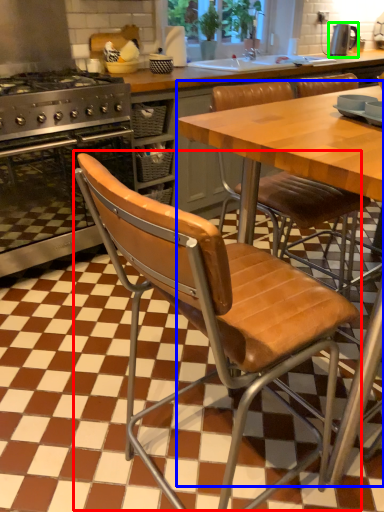
Question: Based on their relative distances, which object is farther from chair (highlighted by a red box)? Choose from table (highlighted by a blue box) and kitchen appliance (highlighted by a green box).

Choices:
 (A) table
 (B) kitchen appliance

Answer: (B)